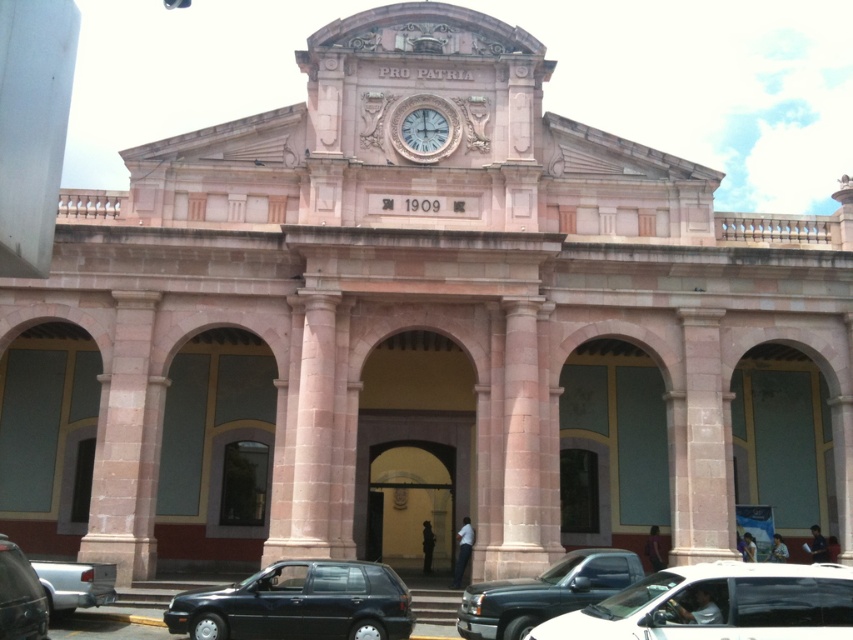
Who is positioned more to the left, matte black car at center or metallic gray car at lower left?

From the viewer's perspective, metallic gray car at lower left appears more on the left side.

Is matte black car at center smaller than metallic gray car at lower left?

No.

Is point (791, 602) more distant than point (45, 611)?

No, it is in front of (45, 611).

This screenshot has height=640, width=853. What are the coordinates of `matte black car at center` in the screenshot? It's located at (718, 604).

Which is below, matte black hatchback at lower left or metallic gray car at lower left?

matte black hatchback at lower left is lower down.

Is point (381, 586) behind point (38, 627)?

Yes.

Identify the location of matte black hatchback at lower left. 299,604.

Which is behind, point (428, 131) or point (48, 580)?

Point (428, 131)

Can you confirm if white marble clock at center is wider than silver metallic truck at lower left?

No, white marble clock at center is not wider than silver metallic truck at lower left.

The image size is (853, 640). What do you see at coordinates (425, 129) in the screenshot? I see `white marble clock at center` at bounding box center [425, 129].

The width and height of the screenshot is (853, 640). I want to click on white marble clock at center, so click(x=425, y=129).